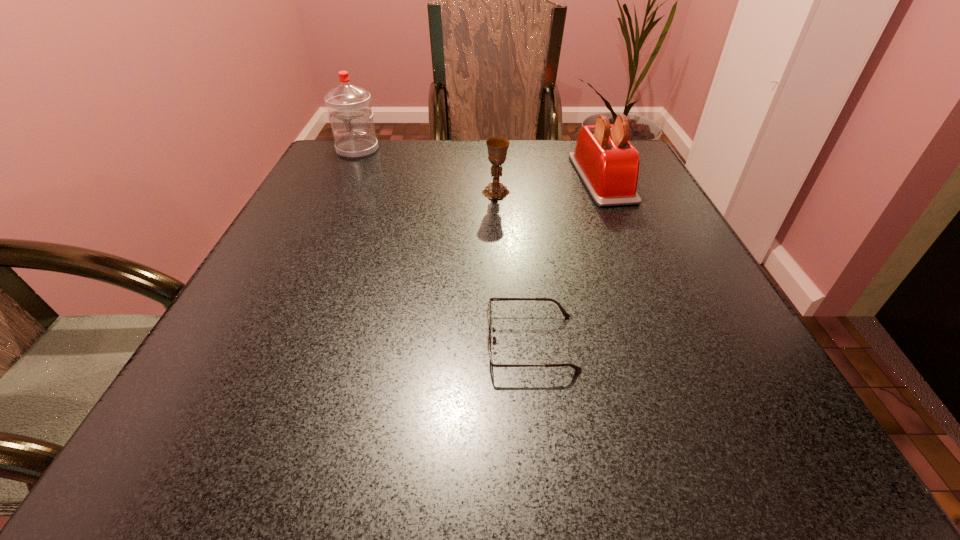
At what (x,y) coordinates should I click in order to perform the action: click on free location located on the front-facing side of the shortest object. Please return your answer as a coordinate pair (x, y). Looking at the image, I should click on (456, 342).

Locate an element on the screen. Image resolution: width=960 pixels, height=540 pixels. vacant area situated on the front-facing side of the shortest object is located at coordinates (287, 342).

Where is `vacant area situated on the front-facing side of the shortest object`? vacant area situated on the front-facing side of the shortest object is located at coordinates (268, 342).

In order to click on water bottle present at the far edge in this screenshot , I will do `click(349, 107)`.

Find the location of a particular element. The width and height of the screenshot is (960, 540). toaster at the far edge is located at coordinates (608, 164).

In order to click on object present at the left edge in this screenshot , I will do `click(349, 107)`.

This screenshot has height=540, width=960. In order to click on object present at the right edge in this screenshot , I will do `click(608, 164)`.

This screenshot has width=960, height=540. Identify the location of object situated at the far left corner. (349, 107).

What are the coordinates of `object located at the far right corner` in the screenshot? It's located at (608, 164).

In the image, there is a desktop. Find the location of `vacant area at the far edge`. vacant area at the far edge is located at coordinates (532, 153).